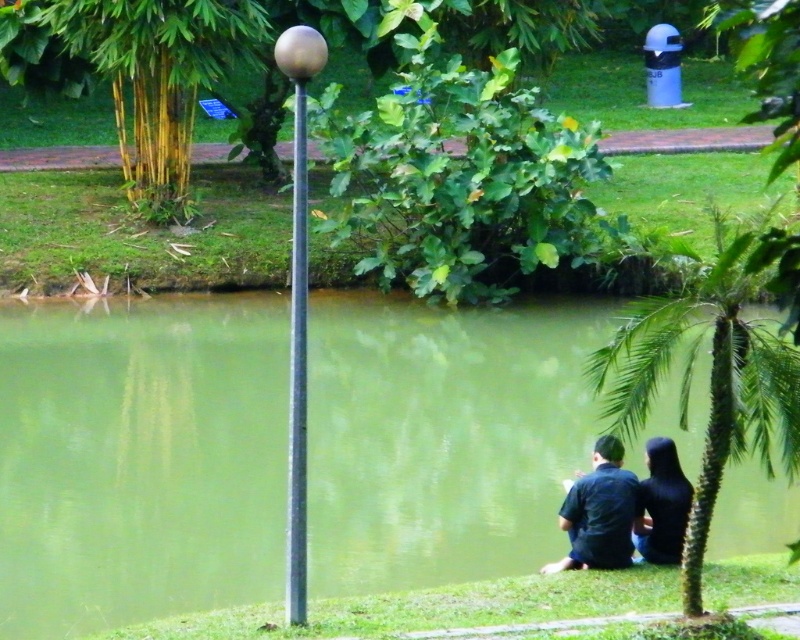
You are standing in the park and want to take a photo of both point (292, 477) and point (584, 552). Since you want both points to be clearly visible in the photo, which point should you focus on to ensure depth of field?

You should focus on point (292, 477) because it is closer to the camera and focusing on the closer object ensures both points will be in focus due to depth of field extending beyond it.